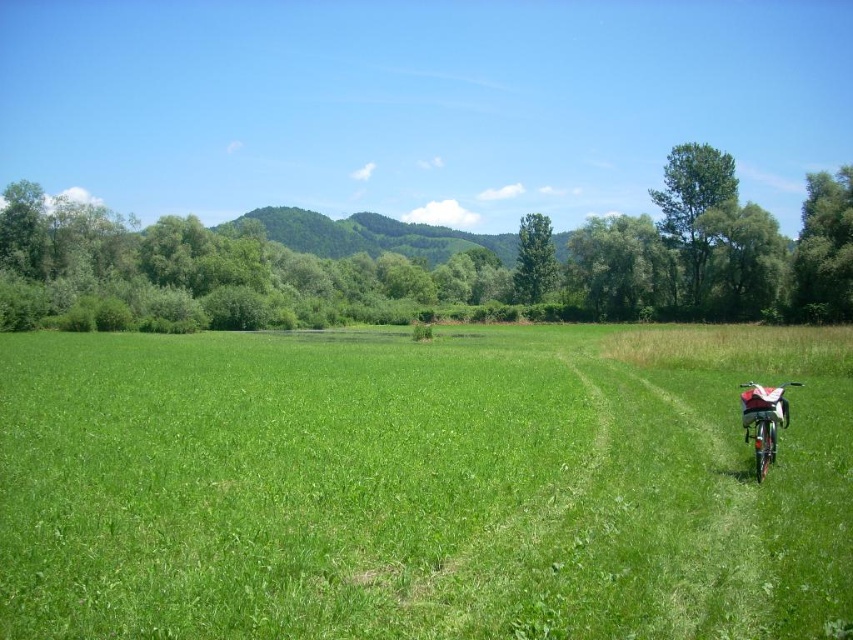
Question: Does green grassy field at center appear over metallic silver bicycle at lower right?

Choices:
 (A) yes
 (B) no

Answer: (A)

Question: Is green grassy field at center wider than metallic silver bicycle at lower right?

Choices:
 (A) yes
 (B) no

Answer: (A)

Question: Can you confirm if green grassy field at center is thinner than metallic silver bicycle at lower right?

Choices:
 (A) no
 (B) yes

Answer: (A)

Question: Which object appears farthest from the camera in this image?

Choices:
 (A) metallic silver bicycle at lower right
 (B) green grassy field at center

Answer: (A)